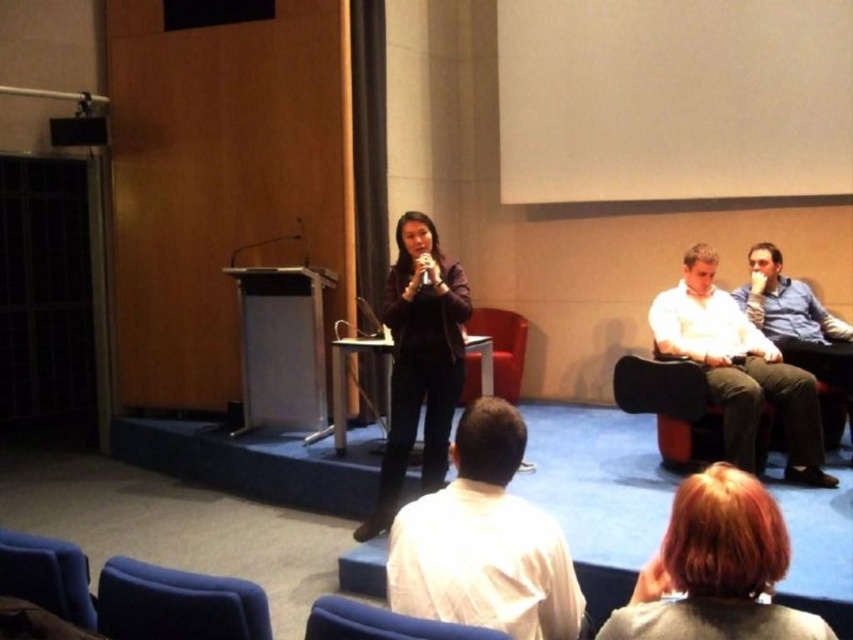
Question: Does blonde hair at lower right have a smaller size compared to blue shirt at right?

Choices:
 (A) yes
 (B) no

Answer: (A)

Question: Which of the following is the closest to the observer?

Choices:
 (A) (19, 563)
 (B) (126, 636)
 (C) (505, 392)

Answer: (B)

Question: Is blonde hair at lower right thinner than velvet blue chair at lower left?

Choices:
 (A) yes
 (B) no

Answer: (B)

Question: Which point is closer to the camera?

Choices:
 (A) white cotton shirt at right
 (B) blue shirt at right
 (C) matte black chair at center
 (D) dark brown leather chair at center

Answer: (A)

Question: Does blue shirt at right have a smaller size compared to velvet blue chair at lower left?

Choices:
 (A) yes
 (B) no

Answer: (B)

Question: Estimate the real-world distances between objects in this image. Which object is farther from the blue shirt at right?

Choices:
 (A) matte black chair at center
 (B) blonde hair at lower right

Answer: (B)